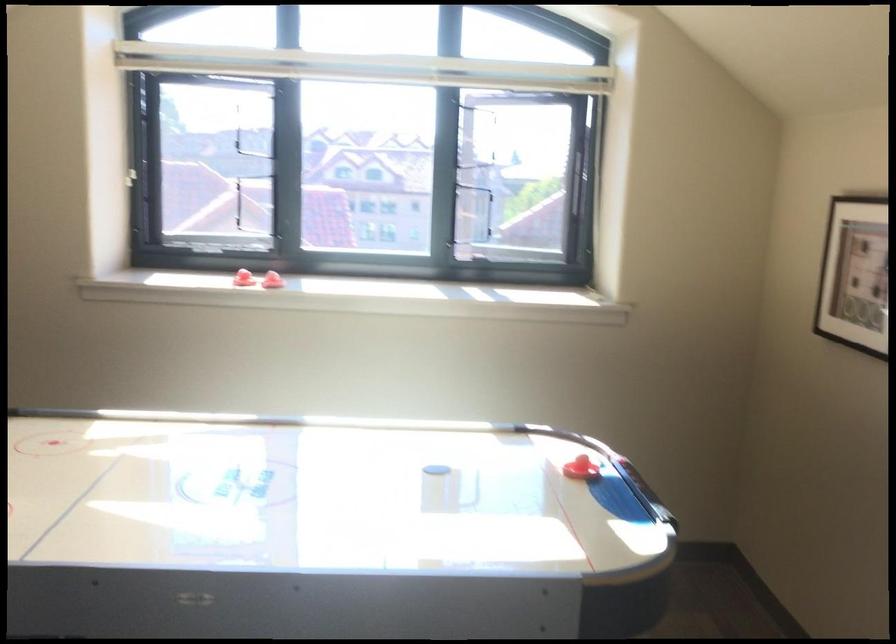
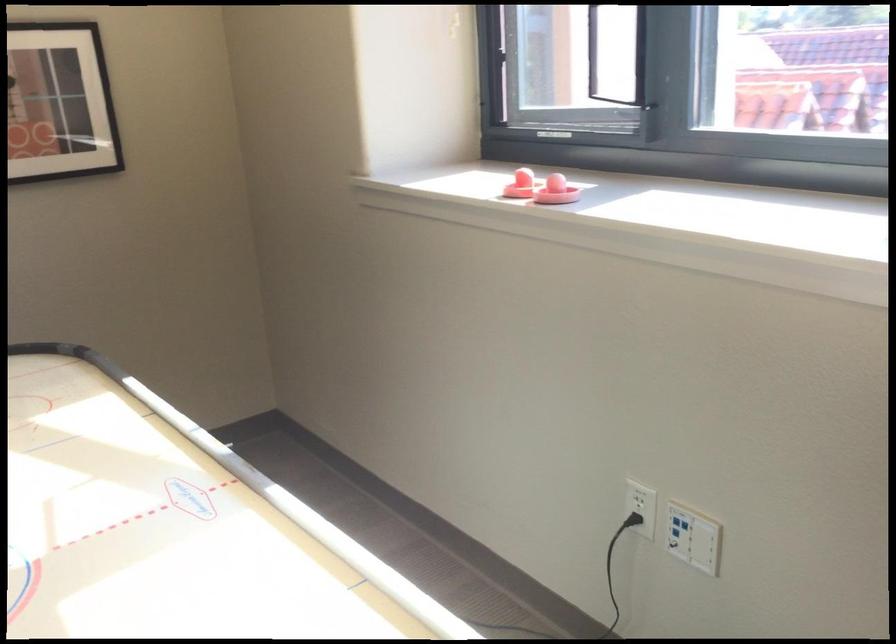
Locate, in the second image, the point that corresponds to (263,278) in the first image.

(556, 191)